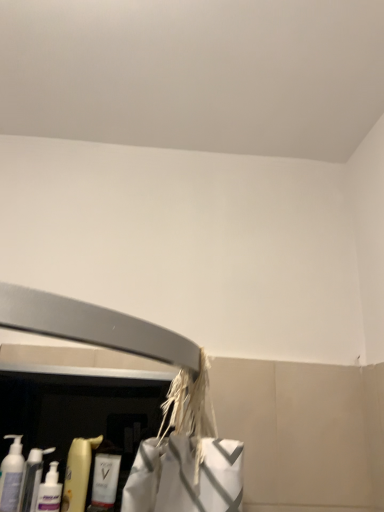
Find the location of `translucent plastic pump bottle at lower left, arranged as the first cleaning product when viewed from the left`. translucent plastic pump bottle at lower left, arranged as the first cleaning product when viewed from the left is located at coordinates (11, 475).

Identify the location of translucent plastic bottle at lower left, which is counted as the 3th cleaning product, starting from the left. The width and height of the screenshot is (384, 512). (78, 473).

At what (x,y) coordinates should I click in order to perform the action: click on white glossy bottle at lower left, which is the 1th cleaning product from right to left. Please return your answer as a coordinate pair (x, y). The height and width of the screenshot is (512, 384). Looking at the image, I should click on (105, 480).

Locate an element on the screen. This screenshot has height=512, width=384. translucent plastic bottles at lower left, acting as the third cleaning product starting from the right is located at coordinates (32, 479).

The width and height of the screenshot is (384, 512). I want to click on translucent plastic pump bottle at lower left, the fourth cleaning product when ordered from right to left, so click(x=11, y=475).

Which is in front, white glossy bottle at lower left, the 4th cleaning product viewed from the left, or translucent plastic bottles at lower left, which is the 2th cleaning product from left to right?

translucent plastic bottles at lower left, which is the 2th cleaning product from left to right, is in front.

From a real-world perspective, who is located higher, white glossy bottle at lower left, the 4th cleaning product viewed from the left, or translucent plastic bottles at lower left, acting as the third cleaning product starting from the right?

In real-world perspective, white glossy bottle at lower left, the 4th cleaning product viewed from the left, is above.

In terms of width, does white glossy bottle at lower left, the 4th cleaning product viewed from the left, look wider or thinner when compared to translucent plastic bottles at lower left, which is the 2th cleaning product from left to right?

Considering their sizes, white glossy bottle at lower left, the 4th cleaning product viewed from the left, looks slimmer than translucent plastic bottles at lower left, which is the 2th cleaning product from left to right.

Is white glossy bottle at lower left, the 4th cleaning product viewed from the left, facing away from translucent plastic bottles at lower left, which is the 2th cleaning product from left to right?

No, white glossy bottle at lower left, the 4th cleaning product viewed from the left, is not facing the opposite direction of translucent plastic bottles at lower left, which is the 2th cleaning product from left to right.

From the image's perspective, does translucent plastic bottle at lower left, the 2th cleaning product from the right, appear lower than translucent plastic pump bottle at lower left, the fourth cleaning product when ordered from right to left?

Indeed, from the image's perspective, translucent plastic bottle at lower left, the 2th cleaning product from the right, is shown beneath translucent plastic pump bottle at lower left, the fourth cleaning product when ordered from right to left.

Is translucent plastic pump bottle at lower left, arranged as the first cleaning product when viewed from the left, located within translucent plastic bottle at lower left, the 2th cleaning product from the right?

Actually, translucent plastic pump bottle at lower left, arranged as the first cleaning product when viewed from the left, is outside translucent plastic bottle at lower left, the 2th cleaning product from the right.

Is point (83, 508) more distant than point (19, 476)?

No, (83, 508) is closer to viewer.

Is translucent plastic bottle at lower left, the 2th cleaning product from the right, next to translucent plastic pump bottle at lower left, the fourth cleaning product when ordered from right to left?

There is a gap between translucent plastic bottle at lower left, the 2th cleaning product from the right, and translucent plastic pump bottle at lower left, the fourth cleaning product when ordered from right to left.

In the image, is translucent plastic pump bottle at lower left, the fourth cleaning product when ordered from right to left, positioned in front of or behind translucent plastic bottles at lower left, acting as the third cleaning product starting from the right?

In the image, translucent plastic pump bottle at lower left, the fourth cleaning product when ordered from right to left, appears in front of translucent plastic bottles at lower left, acting as the third cleaning product starting from the right.

From the image's perspective, would you say translucent plastic pump bottle at lower left, the fourth cleaning product when ordered from right to left, is shown under translucent plastic bottles at lower left, which is the 2th cleaning product from left to right?

No, from the image's perspective, translucent plastic pump bottle at lower left, the fourth cleaning product when ordered from right to left, is not beneath translucent plastic bottles at lower left, which is the 2th cleaning product from left to right.

Is translucent plastic pump bottle at lower left, arranged as the first cleaning product when viewed from the left, outside of translucent plastic bottles at lower left, which is the 2th cleaning product from left to right?

Yes, translucent plastic pump bottle at lower left, arranged as the first cleaning product when viewed from the left, is not within translucent plastic bottles at lower left, which is the 2th cleaning product from left to right.

Can you confirm if translucent plastic pump bottle at lower left, arranged as the first cleaning product when viewed from the left, is bigger than translucent plastic bottles at lower left, which is the 2th cleaning product from left to right?

Yes.

Can you tell me how much translucent plastic bottle at lower left, the 2th cleaning product from the right, and translucent plastic bottles at lower left, which is the 2th cleaning product from left to right, differ in facing direction?

The facing directions of translucent plastic bottle at lower left, the 2th cleaning product from the right, and translucent plastic bottles at lower left, which is the 2th cleaning product from left to right, are 0 degrees apart.

From the image's perspective, which object appears higher, translucent plastic bottle at lower left, which is counted as the 3th cleaning product, starting from the left, or translucent plastic bottles at lower left, acting as the third cleaning product starting from the right?

From the image's view, translucent plastic bottle at lower left, which is counted as the 3th cleaning product, starting from the left, is above.

Does translucent plastic bottle at lower left, the 2th cleaning product from the right, have a lesser height compared to translucent plastic bottles at lower left, acting as the third cleaning product starting from the right?

In fact, translucent plastic bottle at lower left, the 2th cleaning product from the right, may be taller than translucent plastic bottles at lower left, acting as the third cleaning product starting from the right.

Considering the sizes of translucent plastic bottle at lower left, which is counted as the 3th cleaning product, starting from the left, and translucent plastic bottles at lower left, which is the 2th cleaning product from left to right, in the image, is translucent plastic bottle at lower left, which is counted as the 3th cleaning product, starting from the left, wider or thinner than translucent plastic bottles at lower left, which is the 2th cleaning product from left to right,?

Clearly, translucent plastic bottle at lower left, which is counted as the 3th cleaning product, starting from the left, has less width compared to translucent plastic bottles at lower left, which is the 2th cleaning product from left to right.

Is translucent plastic pump bottle at lower left, arranged as the first cleaning product when viewed from the left, oriented away from translucent plastic bottle at lower left, which is counted as the 3th cleaning product, starting from the left?

No, translucent plastic pump bottle at lower left, arranged as the first cleaning product when viewed from the left, is not facing away from translucent plastic bottle at lower left, which is counted as the 3th cleaning product, starting from the left.

Could you measure the distance between translucent plastic pump bottle at lower left, the fourth cleaning product when ordered from right to left, and translucent plastic bottle at lower left, the 2th cleaning product from the right?

translucent plastic pump bottle at lower left, the fourth cleaning product when ordered from right to left, is 4.97 inches away from translucent plastic bottle at lower left, the 2th cleaning product from the right.

The image size is (384, 512). There is a translucent plastic pump bottle at lower left, arranged as the first cleaning product when viewed from the left. Find the location of `the 1st cleaning product below it (from the image's perspective)`. the 1st cleaning product below it (from the image's perspective) is located at coordinates (78, 473).

Choose the correct answer: Is translucent plastic pump bottle at lower left, arranged as the first cleaning product when viewed from the left, inside translucent plastic bottle at lower left, the 2th cleaning product from the right, or outside it?

translucent plastic pump bottle at lower left, arranged as the first cleaning product when viewed from the left, cannot be found inside translucent plastic bottle at lower left, the 2th cleaning product from the right.

Consider the image. Is translucent plastic bottle at lower left, which is counted as the 3th cleaning product, starting from the left, bigger or smaller than white glossy bottle at lower left, which is the 1th cleaning product from right to left?

Clearly, translucent plastic bottle at lower left, which is counted as the 3th cleaning product, starting from the left, is larger in size than white glossy bottle at lower left, which is the 1th cleaning product from right to left.

Considering the sizes of objects translucent plastic bottle at lower left, which is counted as the 3th cleaning product, starting from the left, and white glossy bottle at lower left, the 4th cleaning product viewed from the left, in the image provided, who is taller, translucent plastic bottle at lower left, which is counted as the 3th cleaning product, starting from the left, or white glossy bottle at lower left, the 4th cleaning product viewed from the left,?

translucent plastic bottle at lower left, which is counted as the 3th cleaning product, starting from the left.

How many degrees apart are the facing directions of translucent plastic bottle at lower left, which is counted as the 3th cleaning product, starting from the left, and white glossy bottle at lower left, the 4th cleaning product viewed from the left?

They differ by 0.00237 degrees in their facing directions.

Is translucent plastic bottle at lower left, the 2th cleaning product from the right, positioned behind white glossy bottle at lower left, the 4th cleaning product viewed from the left?

No, it is not.

From the image's perspective, is white glossy bottle at lower left, which is the 1th cleaning product from right to left, under translucent plastic pump bottle at lower left, the fourth cleaning product when ordered from right to left?

Yes, from the image's perspective, white glossy bottle at lower left, which is the 1th cleaning product from right to left, is beneath translucent plastic pump bottle at lower left, the fourth cleaning product when ordered from right to left.

Is the position of white glossy bottle at lower left, the 4th cleaning product viewed from the left, more distant than that of translucent plastic pump bottle at lower left, arranged as the first cleaning product when viewed from the left?

Yes, white glossy bottle at lower left, the 4th cleaning product viewed from the left, is further from the camera.

Does point (98, 504) appear closer or farther from the camera than point (6, 461)?

Point (98, 504) is farther from the camera than point (6, 461).

In the scene shown: Is white glossy bottle at lower left, the 4th cleaning product viewed from the left, to the right of translucent plastic pump bottle at lower left, the fourth cleaning product when ordered from right to left, from the viewer's perspective?

Yes, white glossy bottle at lower left, the 4th cleaning product viewed from the left, is to the right of translucent plastic pump bottle at lower left, the fourth cleaning product when ordered from right to left.

Where is `the 2nd cleaning product behind when counting from the translucent plastic bottles at lower left, acting as the third cleaning product starting from the right`? The height and width of the screenshot is (512, 384). the 2nd cleaning product behind when counting from the translucent plastic bottles at lower left, acting as the third cleaning product starting from the right is located at coordinates (105, 480).

Find the location of a particular element. the 1st cleaning product positioned below the translucent plastic bottle at lower left, the 2th cleaning product from the right (from a real-world perspective) is located at coordinates (11, 475).

Which object lies nearer to the anchor point translucent plastic bottles at lower left, which is the 2th cleaning product from left to right, white glossy bottle at lower left, the 4th cleaning product viewed from the left, or translucent plastic pump bottle at lower left, arranged as the first cleaning product when viewed from the left?

Based on the image, translucent plastic pump bottle at lower left, arranged as the first cleaning product when viewed from the left, appears to be nearer to translucent plastic bottles at lower left, which is the 2th cleaning product from left to right.

Consider the image. When comparing their distances from translucent plastic bottles at lower left, which is the 2th cleaning product from left to right, does white glossy bottle at lower left, the 4th cleaning product viewed from the left, or translucent plastic bottle at lower left, the 2th cleaning product from the right, seem further?

white glossy bottle at lower left, the 4th cleaning product viewed from the left, is positioned further to the anchor translucent plastic bottles at lower left, which is the 2th cleaning product from left to right.

Based on their spatial positions, is translucent plastic bottle at lower left, which is counted as the 3th cleaning product, starting from the left, or translucent plastic pump bottle at lower left, the fourth cleaning product when ordered from right to left, closer to white glossy bottle at lower left, which is the 1th cleaning product from right to left?

Based on the image, translucent plastic bottle at lower left, which is counted as the 3th cleaning product, starting from the left, appears to be nearer to white glossy bottle at lower left, which is the 1th cleaning product from right to left.

Estimate the real-world distances between objects in this image. Which object is closer to translucent plastic pump bottle at lower left, arranged as the first cleaning product when viewed from the left, white glossy bottle at lower left, the 4th cleaning product viewed from the left, or translucent plastic bottle at lower left, the 2th cleaning product from the right?

The object closer to translucent plastic pump bottle at lower left, arranged as the first cleaning product when viewed from the left, is translucent plastic bottle at lower left, the 2th cleaning product from the right.

Which object lies nearer to the anchor point translucent plastic bottles at lower left, acting as the third cleaning product starting from the right, translucent plastic pump bottle at lower left, arranged as the first cleaning product when viewed from the left, or translucent plastic bottle at lower left, which is counted as the 3th cleaning product, starting from the left?

translucent plastic pump bottle at lower left, arranged as the first cleaning product when viewed from the left, is closer to translucent plastic bottles at lower left, acting as the third cleaning product starting from the right.

From the picture: Looking at the image, which one is located further to white glossy bottle at lower left, which is the 1th cleaning product from right to left, translucent plastic pump bottle at lower left, the fourth cleaning product when ordered from right to left, or translucent plastic bottles at lower left, which is the 2th cleaning product from left to right?

Among the two, translucent plastic pump bottle at lower left, the fourth cleaning product when ordered from right to left, is located further to white glossy bottle at lower left, which is the 1th cleaning product from right to left.

Looking at the image, which one is located further to translucent plastic bottle at lower left, the 2th cleaning product from the right, translucent plastic pump bottle at lower left, arranged as the first cleaning product when viewed from the left, or translucent plastic bottles at lower left, which is the 2th cleaning product from left to right?

Among the two, translucent plastic pump bottle at lower left, arranged as the first cleaning product when viewed from the left, is located further to translucent plastic bottle at lower left, the 2th cleaning product from the right.

From the picture: When comparing their distances from translucent plastic pump bottle at lower left, arranged as the first cleaning product when viewed from the left, does translucent plastic bottles at lower left, acting as the third cleaning product starting from the right, or white glossy bottle at lower left, the 4th cleaning product viewed from the left, seem further?

white glossy bottle at lower left, the 4th cleaning product viewed from the left, is further to translucent plastic pump bottle at lower left, arranged as the first cleaning product when viewed from the left.

Identify the location of cleaning product between translucent plastic pump bottle at lower left, the fourth cleaning product when ordered from right to left, and translucent plastic bottle at lower left, which is counted as the 3th cleaning product, starting from the left, in the horizontal direction. Image resolution: width=384 pixels, height=512 pixels. (32, 479).

Find the location of a particular element. The width and height of the screenshot is (384, 512). cleaning product between translucent plastic bottles at lower left, acting as the third cleaning product starting from the right, and white glossy bottle at lower left, which is the 1th cleaning product from right to left, from left to right is located at coordinates (78, 473).